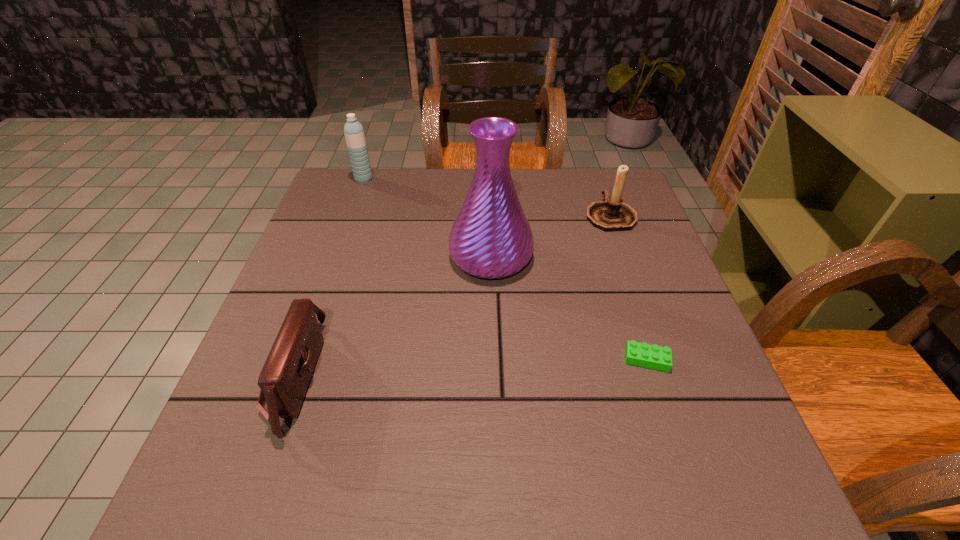
Identify the location of unoccupied position between the third shortest object and the shortest object. The width and height of the screenshot is (960, 540). [x=629, y=287].

This screenshot has height=540, width=960. Identify the location of free space that is in between the fourth shortest object and the shoulder bag. (329, 279).

Locate an element on the screen. This screenshot has height=540, width=960. vacant space in between the shortest object and the tallest object is located at coordinates (568, 308).

Identify the location of free spot between the shoulder bag and the tallest object. The width and height of the screenshot is (960, 540). (393, 317).

In order to click on vacant area between the third tallest object and the third object from left to right in this screenshot , I will do `click(550, 236)`.

This screenshot has width=960, height=540. In order to click on free space between the shoulder bag and the water bottle in this screenshot , I will do [329, 279].

At what (x,y) coordinates should I click in order to perform the action: click on free spot between the third object from right to left and the Lego. Please return your answer as a coordinate pair (x, y). Looking at the image, I should click on (568, 308).

The width and height of the screenshot is (960, 540). In order to click on the second closest object to the third shortest object in this screenshot , I will do `click(653, 356)`.

Identify the location of object that ranks as the fourth closest to the vase. Image resolution: width=960 pixels, height=540 pixels. (354, 134).

Identify the location of vacant space that satisfies the following two spatial constraints: 1. on the front side of the water bottle; 2. on the front flap of the shoulder bag. (294, 377).